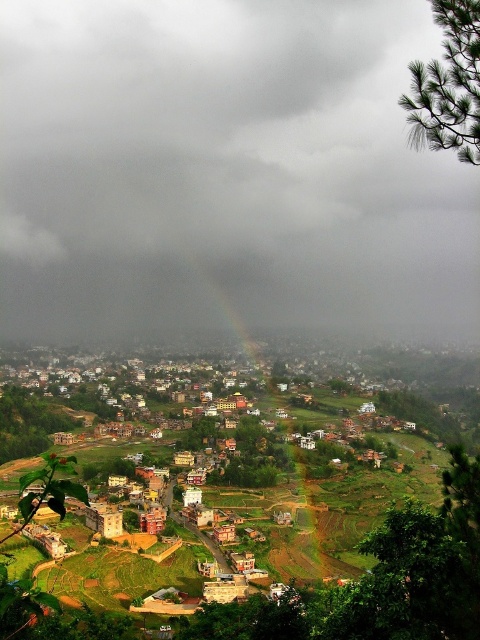
Question: Among these points, which one is nearest to the camera?

Choices:
 (A) (398, 260)
 (B) (320, 572)
 (C) (254, 520)

Answer: (B)

Question: Can you confirm if rainbow at center is wider than multicolored clay houses at center?

Choices:
 (A) no
 (B) yes

Answer: (A)

Question: Which is farther from the rainbow at center?

Choices:
 (A) multicolored clay houses at center
 (B) cloudy gray sky at upper center

Answer: (B)

Question: Which of the following is the farthest from the observer?

Choices:
 (A) (46, 173)
 (B) (274, 557)

Answer: (A)

Question: Is cloudy gray sky at upper center bigger than rainbow at center?

Choices:
 (A) yes
 (B) no

Answer: (A)

Question: Does rainbow at center come behind multicolored clay houses at center?

Choices:
 (A) yes
 (B) no

Answer: (A)